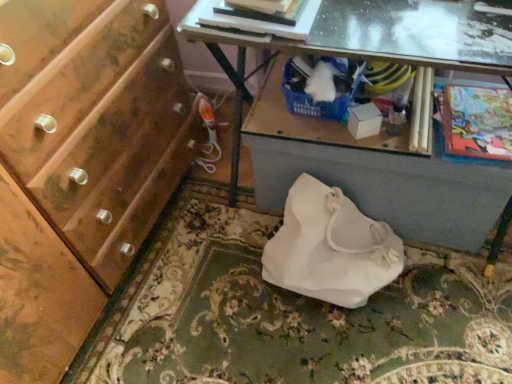
Find the location of a particular element. blank area to the left of white fabric bag at center is located at coordinates (224, 286).